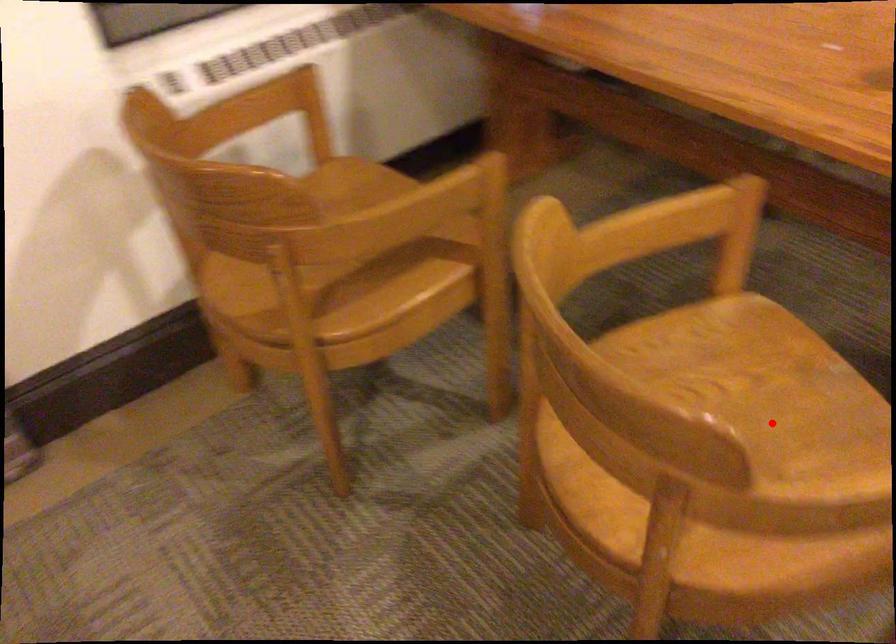
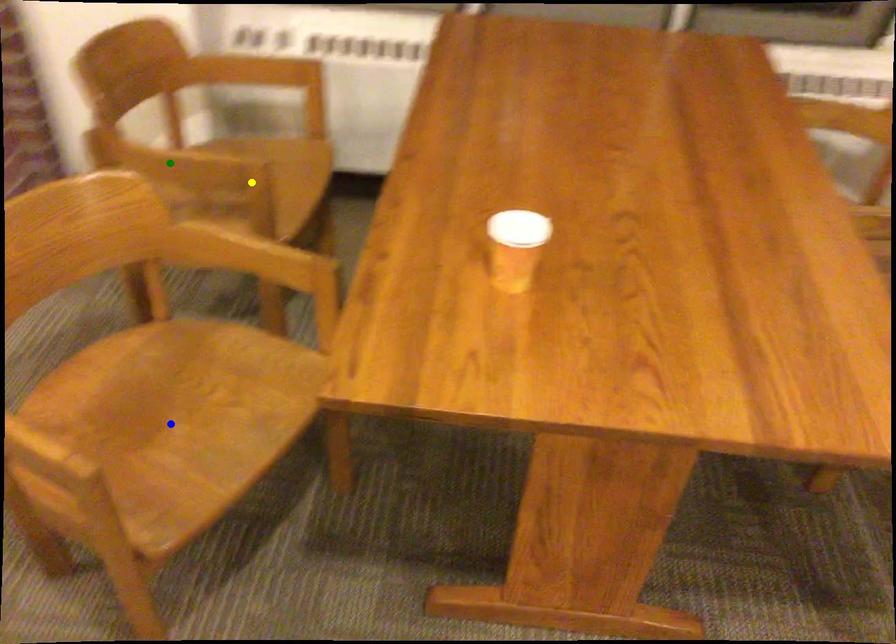
Question: I am providing you with two images of the same scene from different viewpoints. A red point is marked on the first image. You are given multiple points on the second image. Which mark in image 2 goes with the point in image 1?

Choices:
 (A) green point
 (B) blue point
 (C) yellow point

Answer: (B)